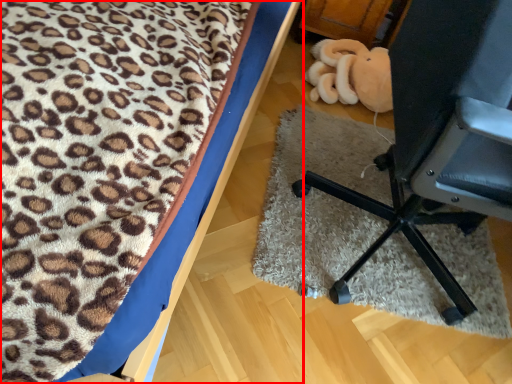
Question: From the image's perspective, where is furniture (annotated by the red box) located relative to furniture?

Choices:
 (A) above
 (B) below

Answer: (A)